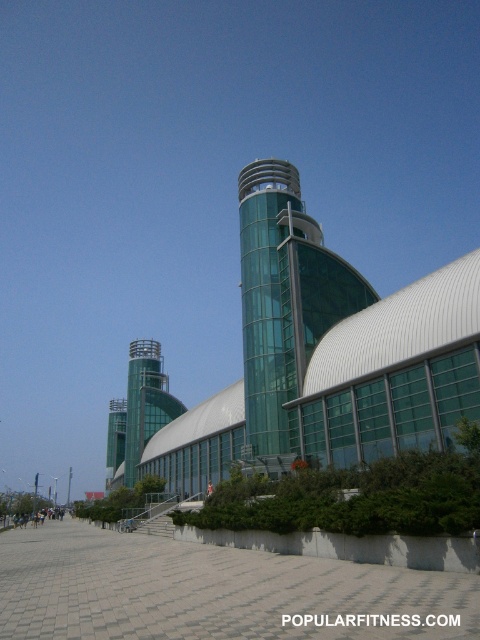
You are standing on the paved walkway and want to take a photo of the transparent glass tower at center. To ensure the tower is centered in your photo, where should you position yourself relative to the walkway?

Since the transparent glass tower at center is located at point 2D coordinates of (x=284, y=305), you should position yourself at the center of the walkway to ensure the tower is centered in your photo.

You are standing at the point marked as point [284,305] in the image. Based on the scene description, what type of surface are you currently standing on?

You are standing on transparent glass tower at center because the point [284,305] is on transparent glass tower at center.